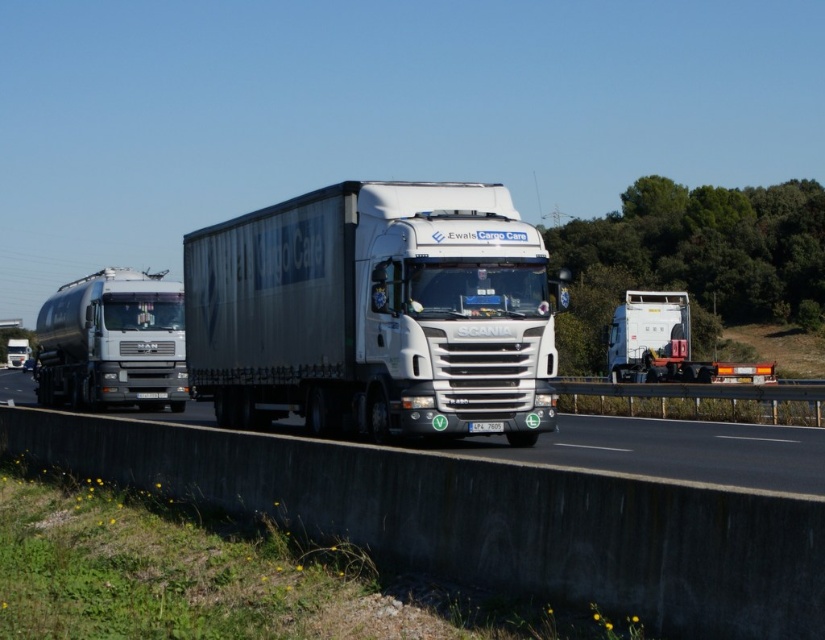
Who is positioned more to the left, white matte trailer truck at center or white glossy truck at center?

white glossy truck at center is more to the left.

Can you confirm if white matte trailer truck at center is smaller than white glossy truck at center?

Yes.

Find the location of a particular element. white matte trailer truck at center is located at coordinates (375, 314).

Based on the photo, does concrete at center come in front of white glossy trailer at right?

Yes, concrete at center is in front of white glossy trailer at right.

Between concrete at center and white glossy trailer at right, which one has less height?

Standing shorter between the two is concrete at center.

Which is in front, point (34, 452) or point (724, 376)?

Point (34, 452) is in front.

This screenshot has height=640, width=825. In order to click on concrete at center in this screenshot , I will do `click(483, 518)`.

Based on the photo, does concrete at center have a larger size compared to white glossy truck at center?

No, concrete at center is not bigger than white glossy truck at center.

Is concrete at center further to camera compared to white glossy truck at center?

That is False.

From the picture: Who is more forward, (646,509) or (772,442)?

Point (646,509) is in front.

I want to click on concrete at center, so click(x=483, y=518).